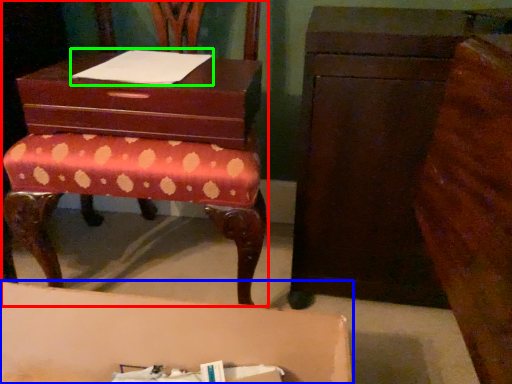
Question: Estimate the real-world distances between objects in this image. Which object is closer to furniture (highlighted by a red box), table (highlighted by a blue box) or book (highlighted by a green box)?

Choices:
 (A) table
 (B) book

Answer: (B)